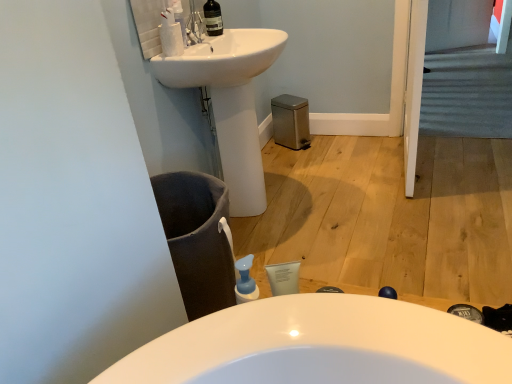
Question: Is carpeted stairs at upper right to the left of white matte cleaning product at upper left from the viewer's perspective?

Choices:
 (A) yes
 (B) no

Answer: (B)

Question: Can you confirm if carpeted stairs at upper right is taller than white matte cleaning product at upper left?

Choices:
 (A) yes
 (B) no

Answer: (B)

Question: Is white matte cleaning product at upper left a part of carpeted stairs at upper right?

Choices:
 (A) no
 (B) yes

Answer: (A)

Question: Is carpeted stairs at upper right turned away from white matte cleaning product at upper left?

Choices:
 (A) no
 (B) yes

Answer: (A)

Question: Does carpeted stairs at upper right come in front of white matte cleaning product at upper left?

Choices:
 (A) no
 (B) yes

Answer: (A)

Question: Is carpeted stairs at upper right positioned far away from white matte cleaning product at upper left?

Choices:
 (A) no
 (B) yes

Answer: (B)

Question: Is transparent glass bottle at upper center far away from white matte cleaning product at upper left?

Choices:
 (A) no
 (B) yes

Answer: (A)

Question: From a real-world perspective, is transparent glass bottle at upper center physically below white matte cleaning product at upper left?

Choices:
 (A) no
 (B) yes

Answer: (B)

Question: Are transparent glass bottle at upper center and white matte cleaning product at upper left making contact?

Choices:
 (A) no
 (B) yes

Answer: (A)

Question: Is transparent glass bottle at upper center to the left of white matte cleaning product at upper left from the viewer's perspective?

Choices:
 (A) yes
 (B) no

Answer: (B)

Question: Is the position of transparent glass bottle at upper center less distant than that of white matte cleaning product at upper left?

Choices:
 (A) yes
 (B) no

Answer: (B)

Question: From the image's perspective, does transparent glass bottle at upper center appear higher than white matte cleaning product at upper left?

Choices:
 (A) yes
 (B) no

Answer: (A)

Question: From a real-world perspective, is white glossy sink at upper center positioned under transparent glass bottle at upper center based on gravity?

Choices:
 (A) yes
 (B) no

Answer: (A)